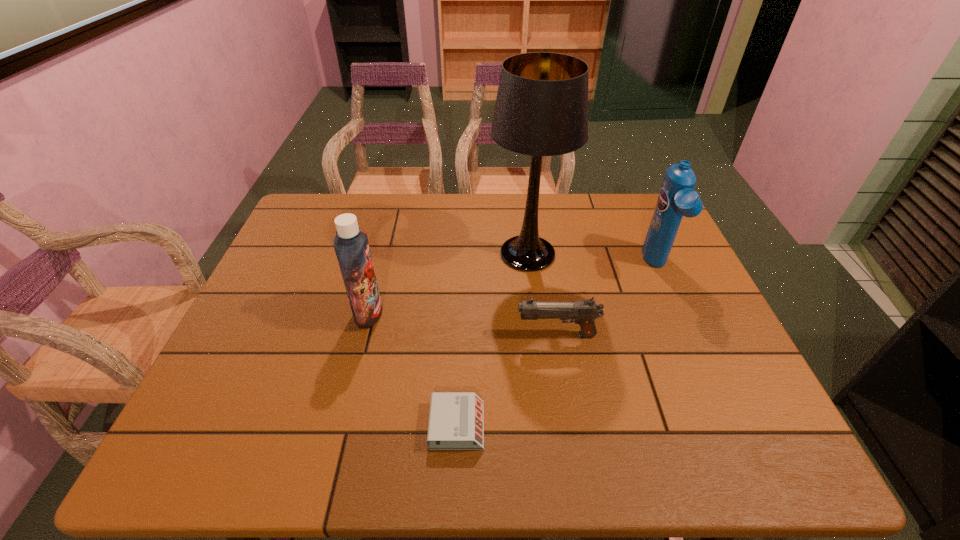
I want to click on free space at the left edge, so click(252, 333).

The width and height of the screenshot is (960, 540). Find the location of `vacant region at the right edge`. vacant region at the right edge is located at coordinates (719, 406).

This screenshot has height=540, width=960. I want to click on vacant position at the far left corner of the desktop, so click(x=300, y=235).

Where is `vacant space at the near left corner of the desktop`? The height and width of the screenshot is (540, 960). vacant space at the near left corner of the desktop is located at coordinates (251, 454).

The image size is (960, 540). In order to click on free space at the near right corner of the desktop in this screenshot , I will do `click(727, 463)`.

Image resolution: width=960 pixels, height=540 pixels. Find the location of `free space between the table lamp and the nearer shampoo`. free space between the table lamp and the nearer shampoo is located at coordinates (448, 284).

I want to click on blank region between the shortest object and the tallest object, so click(492, 340).

Identify the location of vacant area that lies between the gun and the table lamp. tap(542, 294).

You are a GUI agent. You are given a task and a screenshot of the screen. Output one action in this format:
    pyautogui.click(x=<x>, y=<y>)
    Task: Click on the free area in between the nearer shampoo and the second object from left to right
    
    Given the screenshot: What is the action you would take?
    pyautogui.click(x=413, y=369)

This screenshot has height=540, width=960. I want to click on vacant space that's between the right shampoo and the fourth object from right to left, so pos(557,346).